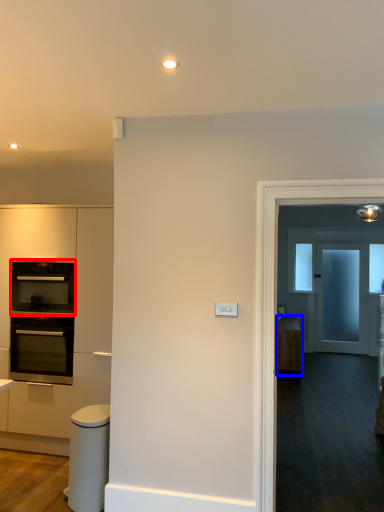
Question: Among these objects, which one is farthest to the camera, oven (highlighted by a red box) or cabinetry (highlighted by a blue box)?

Choices:
 (A) oven
 (B) cabinetry

Answer: (B)